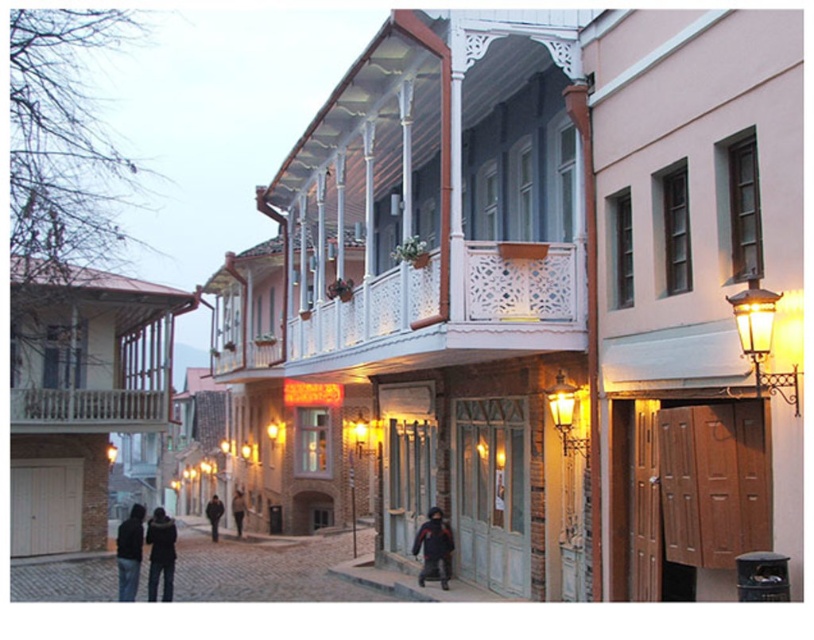
Question: Which point appears closest to the camera in this image?

Choices:
 (A) (330, 321)
 (B) (147, 579)

Answer: (A)

Question: Considering the real-world distances, which object is closest to the white wooden balcony at upper center?

Choices:
 (A) cobblestone street at lower left
 (B) dark gray jacket at center

Answer: (A)

Question: Observing the image, what is the correct spatial positioning of white wooden balcony at upper center in reference to dark blue jacket at lower left?

Choices:
 (A) above
 (B) below

Answer: (A)

Question: Where is white carved wood balcony at center located in relation to wooden balcony at center in the image?

Choices:
 (A) above
 (B) below

Answer: (A)

Question: Which of these objects is positioned farthest from the golden brass streetlamp at right?

Choices:
 (A) golden wrought iron streetlamp at right
 (B) white wooden balcony at upper center
 (C) dark blue jacket at center

Answer: (B)

Question: Is golden brass streetlamp at right further to camera compared to dark blue jacket at lower center?

Choices:
 (A) yes
 (B) no

Answer: (B)